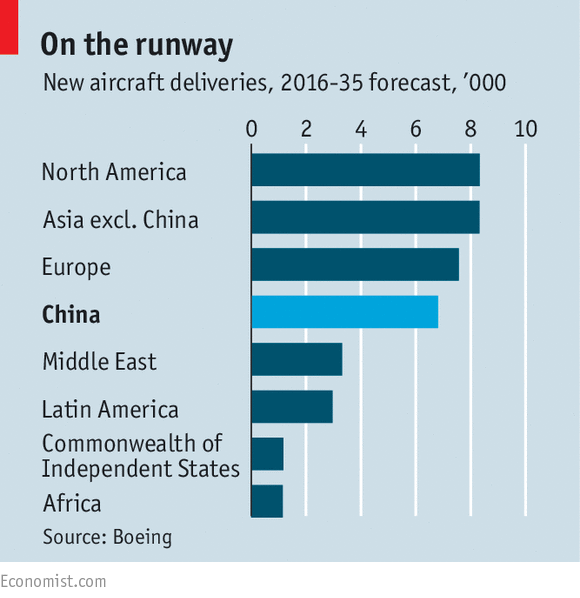
Where is `bar`? Image resolution: width=580 pixels, height=598 pixels. bar is located at coordinates pos(427,151).